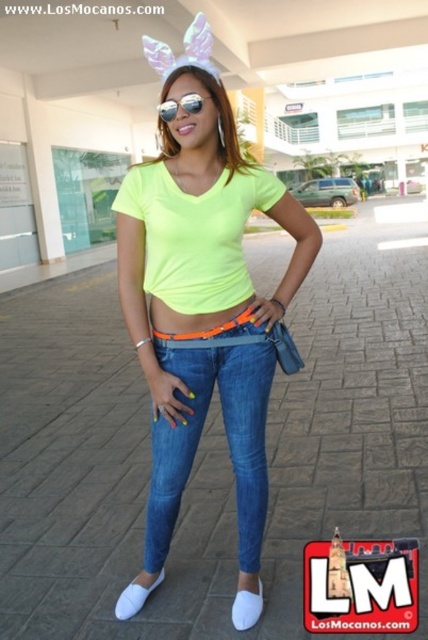
You are a fashion designer analyzing the outfit of a person in an image. You notice the denim jeans at center and the white leather shoe at lower center. Which item of clothing is bigger in size?

The denim jeans at center has a larger size compared to the white leather shoe at lower center.

You are a fashion designer observing this outfit. You need to place a new accessory between the neon yellow fabric top at center and the white fabric shoe at lower center. Based on their positions, which object should the accessory be closer to?

The accessory should be closer to the white fabric shoe at lower center because the neon yellow fabric top at center is to the left of it, meaning the shoe is on the right side.

Based on the scene description, can you determine if the neon yellow fabric top at center is above or below the white fabric shoe at lower center?

The neon yellow fabric top at center is positioned over the white fabric shoe at lower center, meaning it is above it.